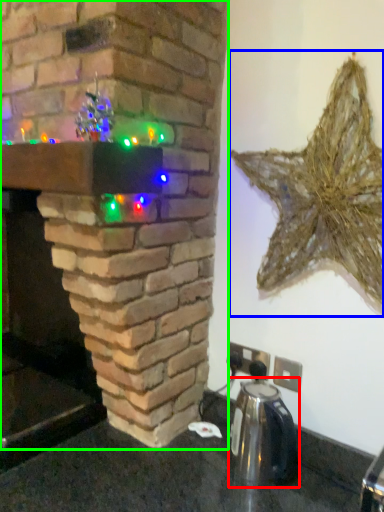
Question: Which is farther away from appliance (highlighted by a red box)? star (highlighted by a blue box) or fireplace (highlighted by a green box)?

Choices:
 (A) star
 (B) fireplace

Answer: (B)